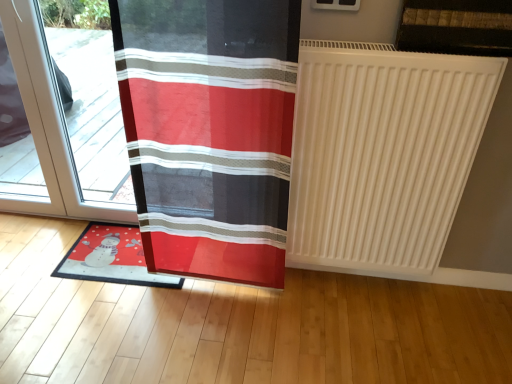
Question: Is transparent glass door at left oriented towards matte plastic mat at lower left?

Choices:
 (A) no
 (B) yes

Answer: (A)

Question: Can you confirm if transparent glass door at left is positioned to the right of matte plastic mat at lower left?

Choices:
 (A) yes
 (B) no

Answer: (B)

Question: Does transparent glass door at left have a smaller size compared to matte plastic mat at lower left?

Choices:
 (A) yes
 (B) no

Answer: (B)

Question: Is matte plastic mat at lower left at the back of transparent glass door at left?

Choices:
 (A) yes
 (B) no

Answer: (B)

Question: Is transparent glass door at left thinner than matte plastic mat at lower left?

Choices:
 (A) no
 (B) yes

Answer: (B)

Question: From a real-world perspective, is transparent glass door at left positioned under matte plastic mat at lower left based on gravity?

Choices:
 (A) yes
 (B) no

Answer: (B)

Question: Is red fabric curtain at left behind matte plastic mat at lower left?

Choices:
 (A) no
 (B) yes

Answer: (A)

Question: Can you confirm if red fabric curtain at left is bigger than matte plastic mat at lower left?

Choices:
 (A) no
 (B) yes

Answer: (B)

Question: Does red fabric curtain at left appear on the left side of matte plastic mat at lower left?

Choices:
 (A) no
 (B) yes

Answer: (A)

Question: Can you confirm if red fabric curtain at left is thinner than matte plastic mat at lower left?

Choices:
 (A) yes
 (B) no

Answer: (A)

Question: From a real-world perspective, is red fabric curtain at left over matte plastic mat at lower left?

Choices:
 (A) no
 (B) yes

Answer: (B)

Question: Are red fabric curtain at left and matte plastic mat at lower left far apart?

Choices:
 (A) yes
 (B) no

Answer: (B)

Question: From the image's perspective, is matte plastic mat at lower left below white matte radiator at right?

Choices:
 (A) no
 (B) yes

Answer: (B)